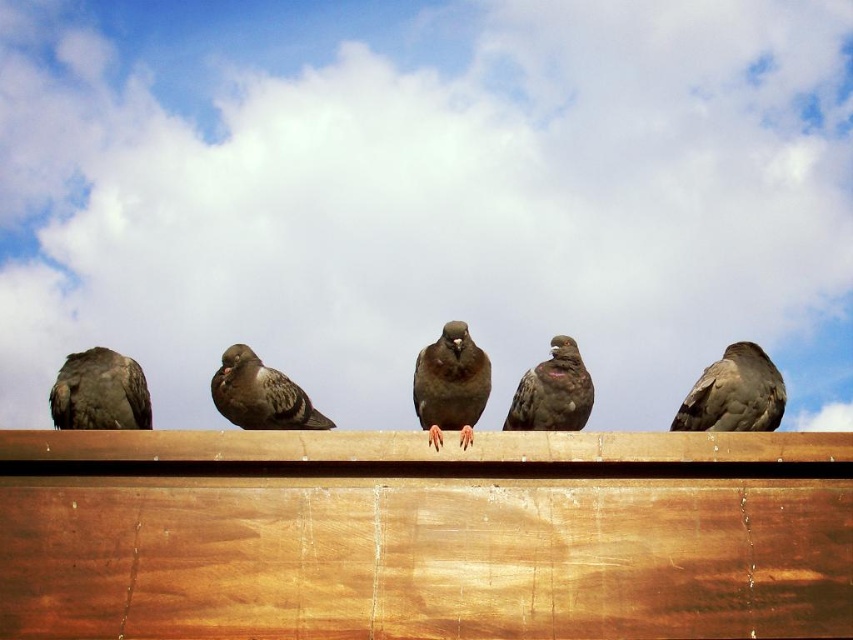
In the scene shown: You are a birdwatcher observing the pigeons. You notice two pigeons at the center of the image. Which pigeon is closer to the ground, the brown feathered pigeon at center or the brown speckled pigeon at center?

The brown feathered pigeon at center is positioned under the brown speckled pigeon at center, so it is closer to the ground.

Looking at this image, you are a birdwatcher observing the pigeons. You notice the brown feathered pigeon at left and the brown speckled pigeon at center. Which pigeon is closer to you?

The brown feathered pigeon at left is closer to you because the brown speckled pigeon at center is behind it.